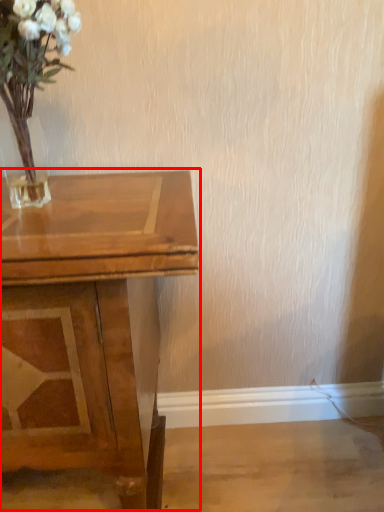
Question: From the image, what is the correct spatial relationship of table (annotated by the red box) in relation to floral arrangement?

Choices:
 (A) right
 (B) left

Answer: (B)